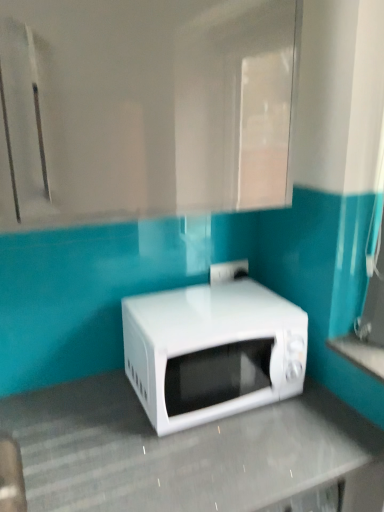
Image resolution: width=384 pixels, height=512 pixels. I want to click on free space above white glossy microwave at center, placed as the 2th counter top when sorted from top to bottom (from a real-world perspective), so click(x=199, y=445).